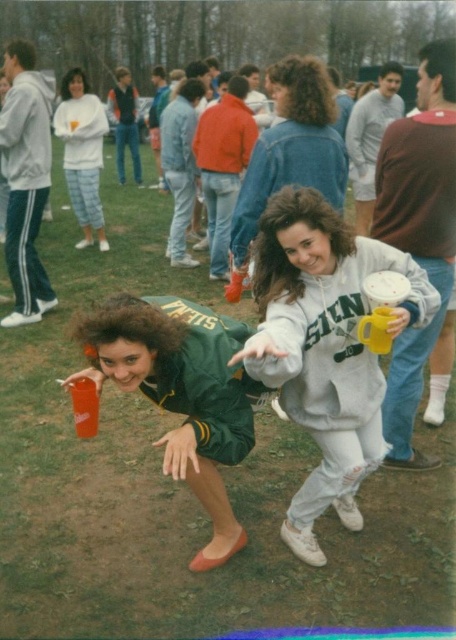
You are at an outdoor event and notice a white fleece sweatshirt at upper left and a translucent plastic cup at lower left. Which object is closer to you?

The white fleece sweatshirt at upper left is closer to you because the translucent plastic cup at lower left is behind it.